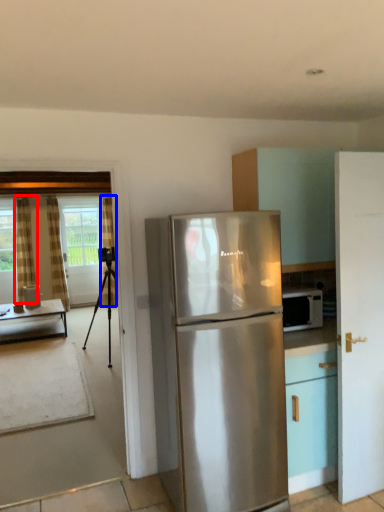
Question: Which of the following is the farthest to the observer, curtain (highlighted by a red box) or curtain (highlighted by a blue box)?

Choices:
 (A) curtain
 (B) curtain

Answer: (B)